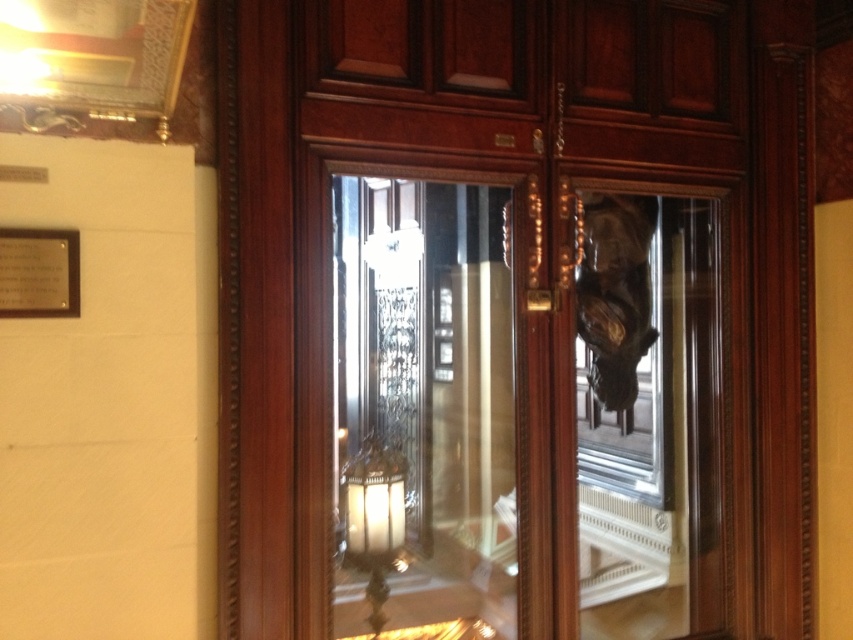
You are an interior designer assessing the doors in the image. You need to determine which door has a greater height between the transparent glass door at center and the clear glass door at center. Which one is taller?

The transparent glass door at center is much taller than the clear glass door at center according to the description.

You are standing in front of two doors in a historic building. You see a transparent glass door at center and a clear glass door at center. Which door is on the right side when facing the entrance?

The transparent glass door at center is positioned on the right side of the clear glass door at center, so when facing the entrance, the transparent glass door at center is on the right side.